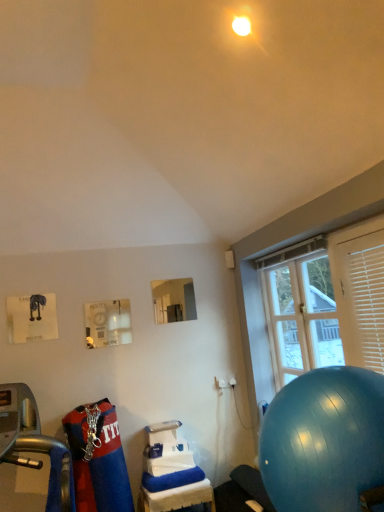
Question: Is clear glass window at right taller than blue rubber ball at lower right?

Choices:
 (A) yes
 (B) no

Answer: (A)

Question: Would you say blue rubber ball at lower right is part of clear glass window at right's contents?

Choices:
 (A) no
 (B) yes

Answer: (A)

Question: Is clear glass window at right not close to blue rubber ball at lower right?

Choices:
 (A) no
 (B) yes

Answer: (A)

Question: From a real-world perspective, is clear glass window at right under blue rubber ball at lower right?

Choices:
 (A) no
 (B) yes

Answer: (A)

Question: Can you confirm if clear glass window at right is thinner than blue rubber ball at lower right?

Choices:
 (A) no
 (B) yes

Answer: (B)

Question: From the image's perspective, is clear glass window at right on top of blue rubber ball at lower right?

Choices:
 (A) no
 (B) yes

Answer: (B)

Question: Can you confirm if white plastic blinds at right is wider than white plastic table at lower center?

Choices:
 (A) no
 (B) yes

Answer: (A)

Question: Can you confirm if white plastic blinds at right is bigger than white plastic table at lower center?

Choices:
 (A) no
 (B) yes

Answer: (A)

Question: Does white plastic blinds at right have a smaller size compared to white plastic table at lower center?

Choices:
 (A) no
 (B) yes

Answer: (B)

Question: From the image's perspective, does white plastic blinds at right appear lower than white plastic table at lower center?

Choices:
 (A) no
 (B) yes

Answer: (A)

Question: Is white plastic blinds at right at the left side of white plastic table at lower center?

Choices:
 (A) no
 (B) yes

Answer: (A)

Question: Can you see white plastic blinds at right touching white plastic table at lower center?

Choices:
 (A) no
 (B) yes

Answer: (A)

Question: Is blue rubber ball at lower right located outside white plastic table at lower center?

Choices:
 (A) no
 (B) yes

Answer: (B)